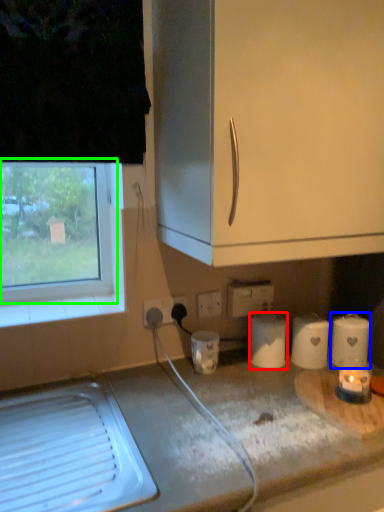
Question: Which object is the closest to the paper towel (highlighted by a red box)? Choose among these: paper towel (highlighted by a blue box) or window (highlighted by a green box).

Choices:
 (A) paper towel
 (B) window

Answer: (A)